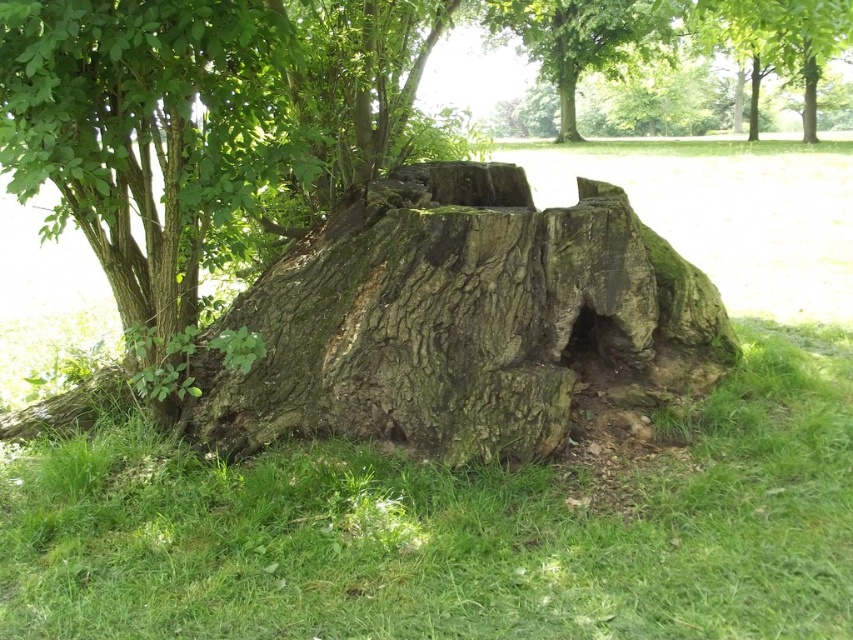
Question: Considering the real-world distances, which object is farthest from the green mossy stump at center?

Choices:
 (A) smooth green bark at upper center
 (B) green grass at lower center
 (C) green rough bark stump at upper center

Answer: (A)

Question: Can you confirm if green mossy stump at center is positioned to the left of green rough bark stump at upper center?

Choices:
 (A) no
 (B) yes

Answer: (B)

Question: Which object is the closest to the green grass at lower center?

Choices:
 (A) green mossy hole at lower center
 (B) smooth green bark at upper center
 (C) green mossy stump at center
 (D) green rough bark stump at upper center

Answer: (C)

Question: Is green mossy stump at center thinner than green rough bark stump at upper center?

Choices:
 (A) no
 (B) yes

Answer: (B)

Question: Which of the following is the closest to the observer?

Choices:
 (A) pos(788,12)
 (B) pos(618,372)
 (C) pos(543,42)
 (D) pos(785,376)

Answer: (B)

Question: Is green mossy stump at center to the right of smooth green bark at upper center from the viewer's perspective?

Choices:
 (A) yes
 (B) no

Answer: (B)